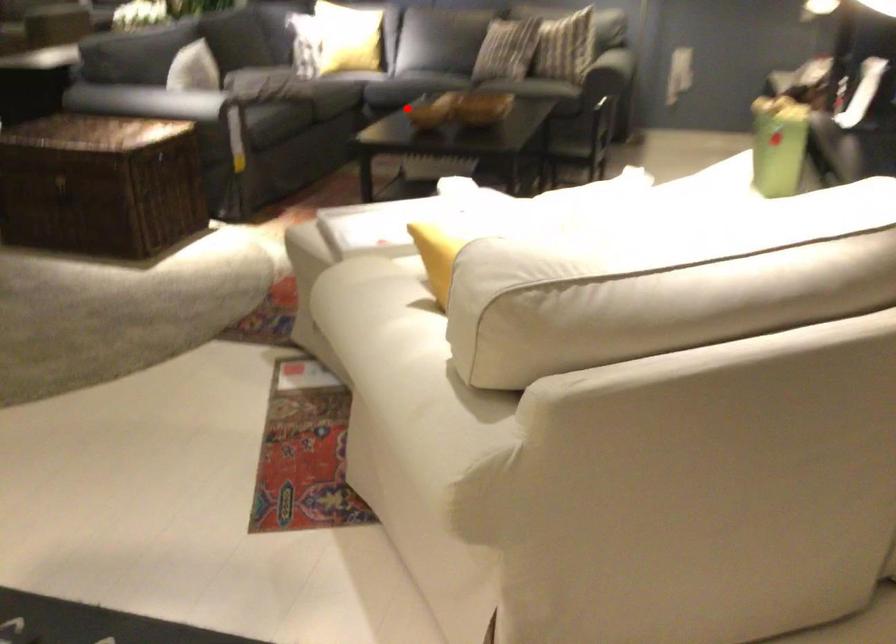
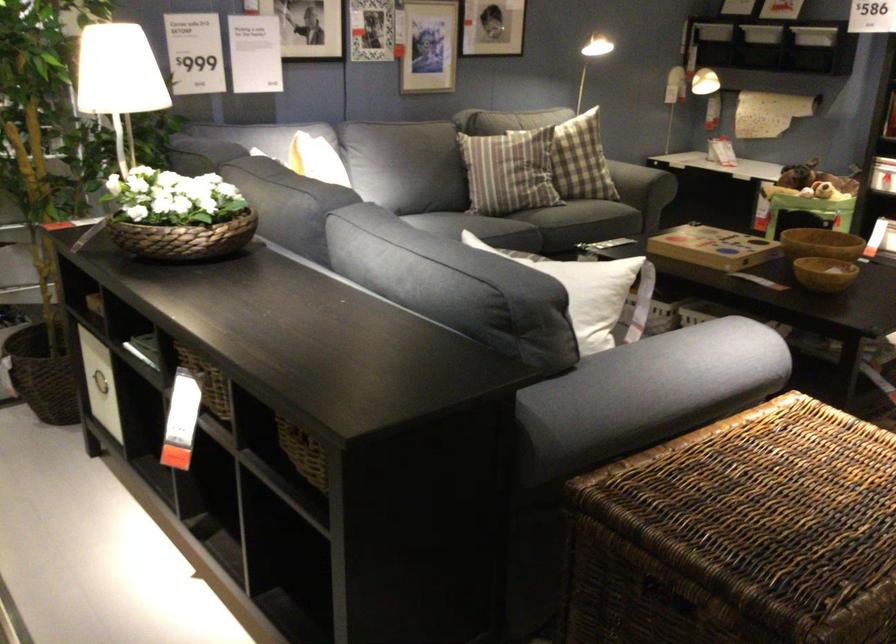
Locate, in the second image, the point that corresponds to the highlighted location in the first image.

(823, 272)